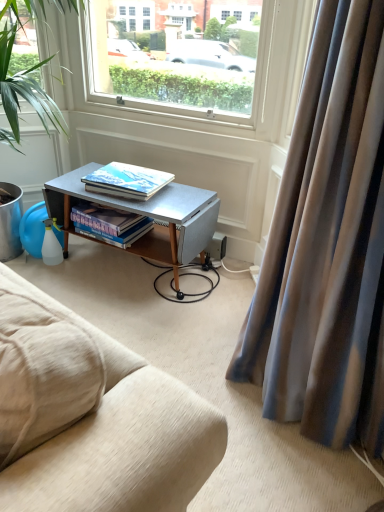
You are a GUI agent. You are given a task and a screenshot of the screen. Output one action in this format:
    pyautogui.click(x=<x>, y=<y>)
    Task: Click on the vacant space situated on the left part of satin fabric curtain at right
    
    Given the screenshot: What is the action you would take?
    pyautogui.click(x=189, y=352)